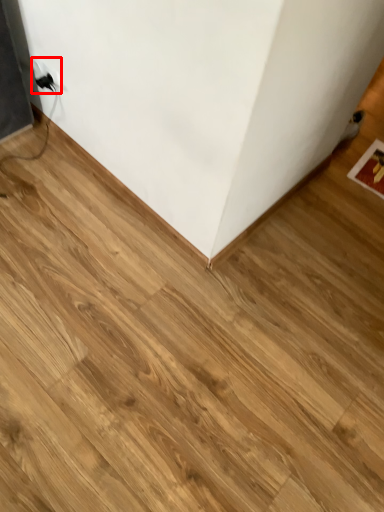
Question: In this image, where is electric outlet (annotated by the red box) located relative to furniture?

Choices:
 (A) right
 (B) left

Answer: (B)